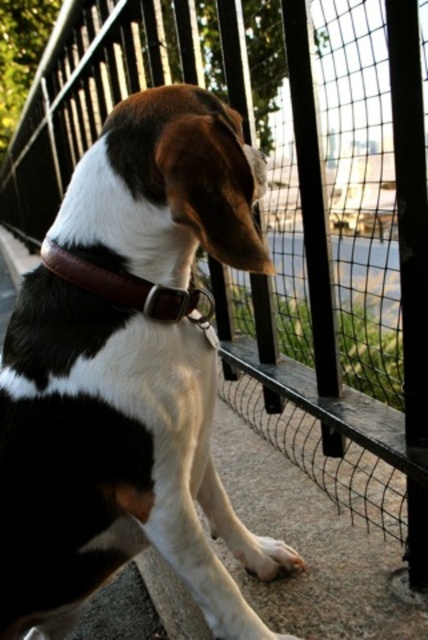
From the picture: Is black and white fur at center wider than brown leather collar at center?

Correct, the width of black and white fur at center exceeds that of brown leather collar at center.

Who is more forward, [68,582] or [110,282]?

Positioned in front is point [110,282].

Does point (68, 228) come farther from viewer compared to point (74, 278)?

Yes, it is behind point (74, 278).

This screenshot has width=428, height=640. I want to click on black and white fur at center, so click(128, 372).